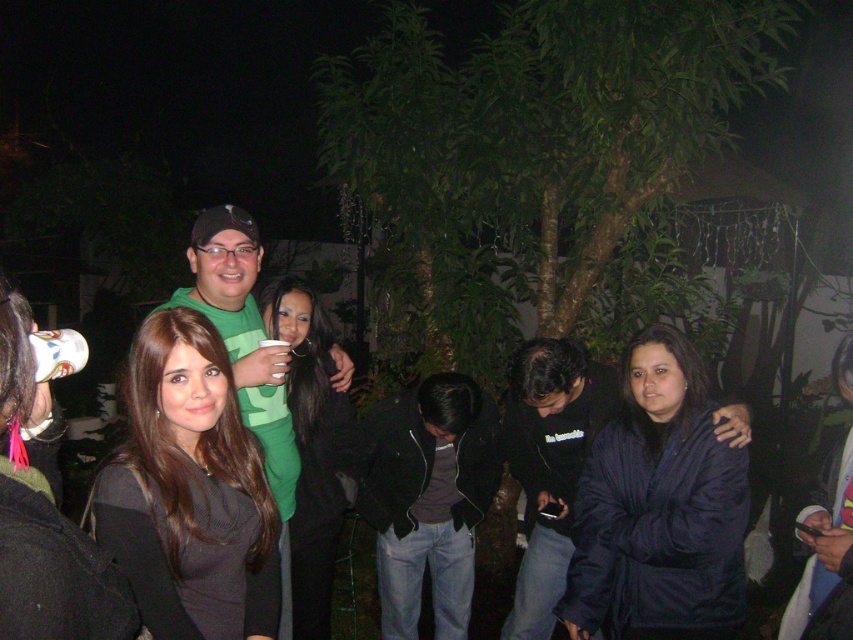
Between point (204, 550) and point (216, 234), which one is positioned behind?

Positioned behind is point (216, 234).

Can you confirm if black matte dress at center is taller than green matte shirt at center?

No.

Which is behind, point (196, 323) or point (200, 244)?

Point (200, 244)

Where is `black matte dress at center`? This screenshot has height=640, width=853. black matte dress at center is located at coordinates (189, 490).

The width and height of the screenshot is (853, 640). What do you see at coordinates (189, 490) in the screenshot?
I see `black matte dress at center` at bounding box center [189, 490].

Is black matte dress at center thinner than dark blue jacket at lower right?

Yes, black matte dress at center is thinner than dark blue jacket at lower right.

Is point (213, 630) positioned behind point (694, 376)?

No, (213, 630) is closer to viewer.

Where is `black matte dress at center`? black matte dress at center is located at coordinates (189, 490).

From the picture: Can you confirm if dark blue jacket at lower right is thinner than green matte shirt at center?

Yes, dark blue jacket at lower right is thinner than green matte shirt at center.

Who is shorter, dark blue jacket at lower right or green matte shirt at center?

Standing shorter between the two is dark blue jacket at lower right.

Is point (595, 461) closer to viewer compared to point (228, 241)?

No, it is behind (228, 241).

The image size is (853, 640). Find the location of `dark blue jacket at lower right`. dark blue jacket at lower right is located at coordinates (659, 508).